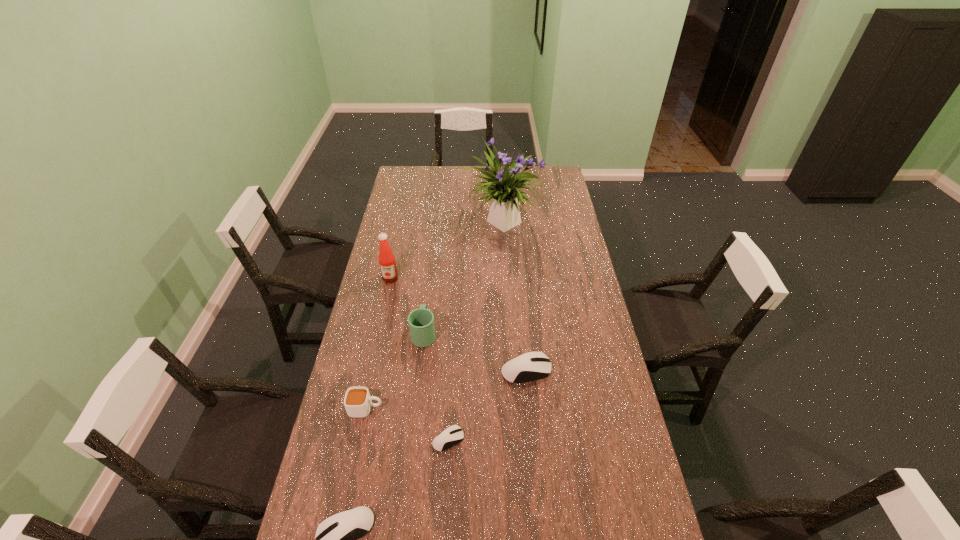
At what (x,y) coordinates should I click in order to perform the action: click on the shortest object. Please return your answer as a coordinate pair (x, y). Image resolution: width=960 pixels, height=540 pixels. Looking at the image, I should click on click(x=452, y=435).

I want to click on the shortest mouse, so click(x=452, y=435).

The width and height of the screenshot is (960, 540). In order to click on the rightmost mouse in this screenshot , I will do `click(534, 365)`.

At what (x,y) coordinates should I click in order to perform the action: click on the farthest mouse. Please return your answer as a coordinate pair (x, y). Looking at the image, I should click on (534, 365).

Where is `mug`? This screenshot has width=960, height=540. mug is located at coordinates (421, 321).

At what (x,y) coordinates should I click in order to perform the action: click on the fifth nearest object. Please return your answer as a coordinate pair (x, y). Looking at the image, I should click on (421, 321).

I want to click on the second tallest object, so click(x=388, y=268).

In order to click on condiment in this screenshot , I will do click(388, 268).

Find the location of a particular element. The width and height of the screenshot is (960, 540). flower arrangement is located at coordinates (504, 214).

This screenshot has width=960, height=540. What are the coordinates of `the farthest object` in the screenshot? It's located at (504, 214).